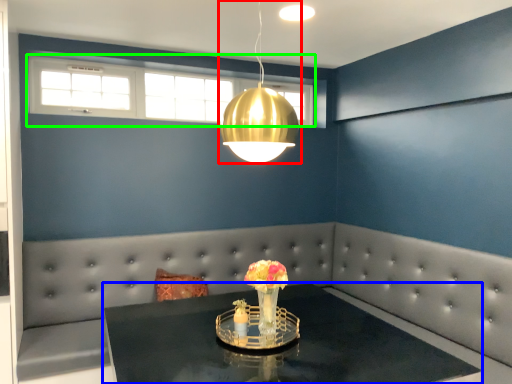
Question: Estimate the real-world distances between objects in this image. Which object is farther from lamp (highlighted by a red box), table (highlighted by a blue box) or window (highlighted by a green box)?

Choices:
 (A) table
 (B) window

Answer: (B)